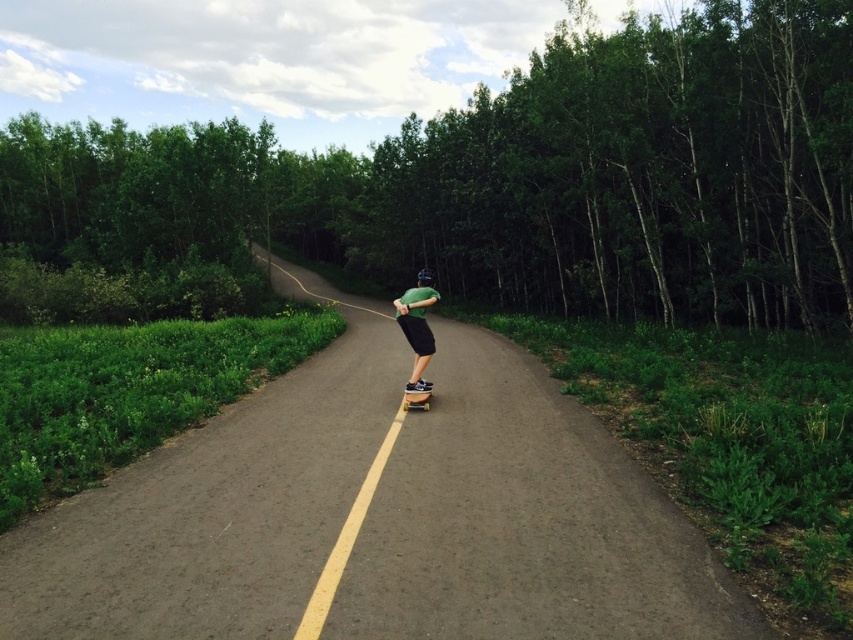
In the scene shown: Is green leafy tree at center below green matte shirt at center?

No.

Which is more to the left, green leafy tree at center or green matte shirt at center?

green leafy tree at center

Identify the location of green leafy tree at center. Image resolution: width=853 pixels, height=640 pixels. (512, 179).

Locate an element on the screen. The width and height of the screenshot is (853, 640). green leafy tree at center is located at coordinates (512, 179).

Is green matte shirt at center above wooden skateboard at center?

Indeed, green matte shirt at center is positioned over wooden skateboard at center.

What do you see at coordinates (416, 326) in the screenshot? I see `green matte shirt at center` at bounding box center [416, 326].

Between point (416, 349) and point (405, 394), which one is positioned behind?

The point (416, 349) is behind.

Find the location of a particular element. The image size is (853, 640). green matte shirt at center is located at coordinates (416, 326).

Is green leafy tree at center thinner than wooden skateboard at center?

No, green leafy tree at center is not thinner than wooden skateboard at center.

In the scene shown: Which is below, green leafy tree at center or wooden skateboard at center?

wooden skateboard at center

Does point (660, 32) come in front of point (424, 406)?

No, (660, 32) is further to viewer.

Where is `green leafy tree at center`? This screenshot has height=640, width=853. green leafy tree at center is located at coordinates (512, 179).